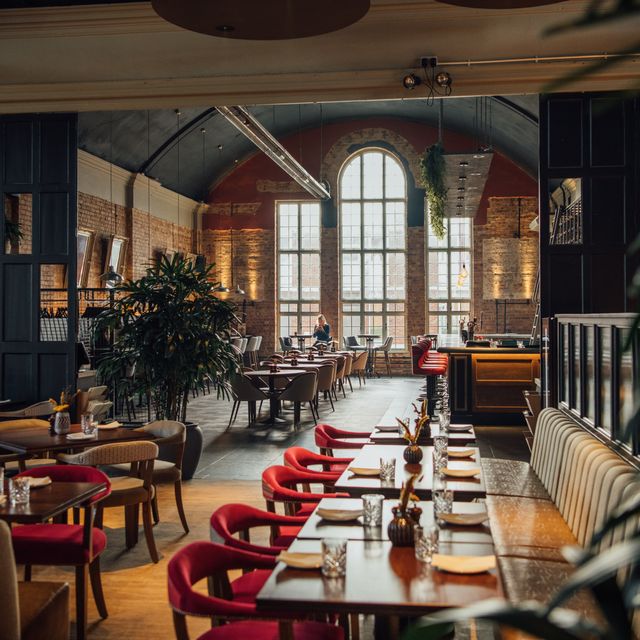
The image size is (640, 640). I want to click on red wall, so click(x=242, y=193).